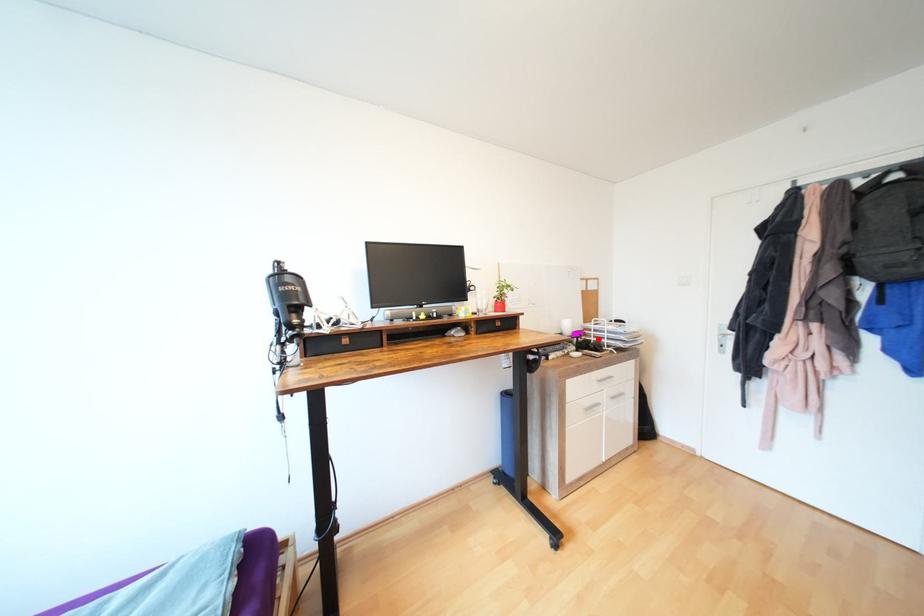
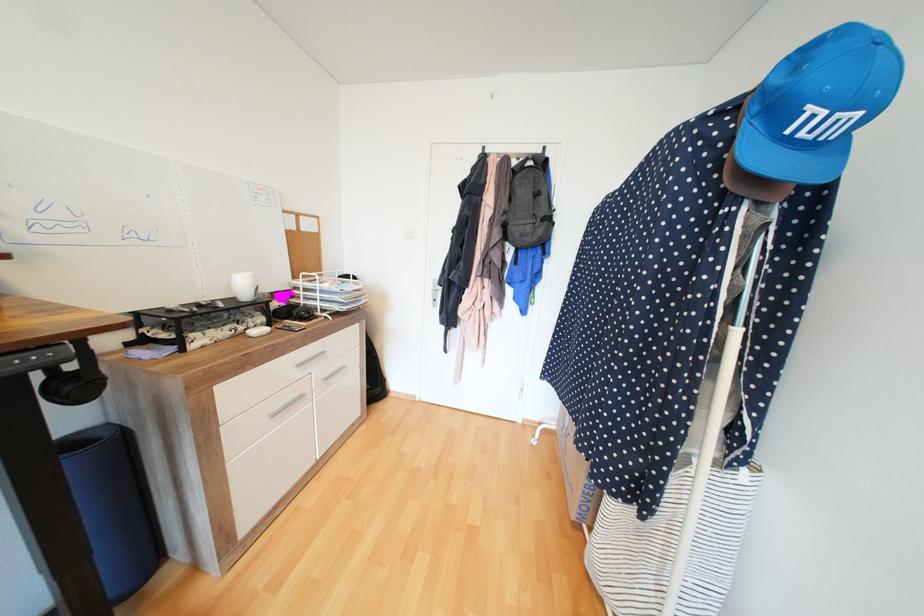
Locate, in the second image, the point that corresponds to the highlighted location in the first image.

(308, 302)